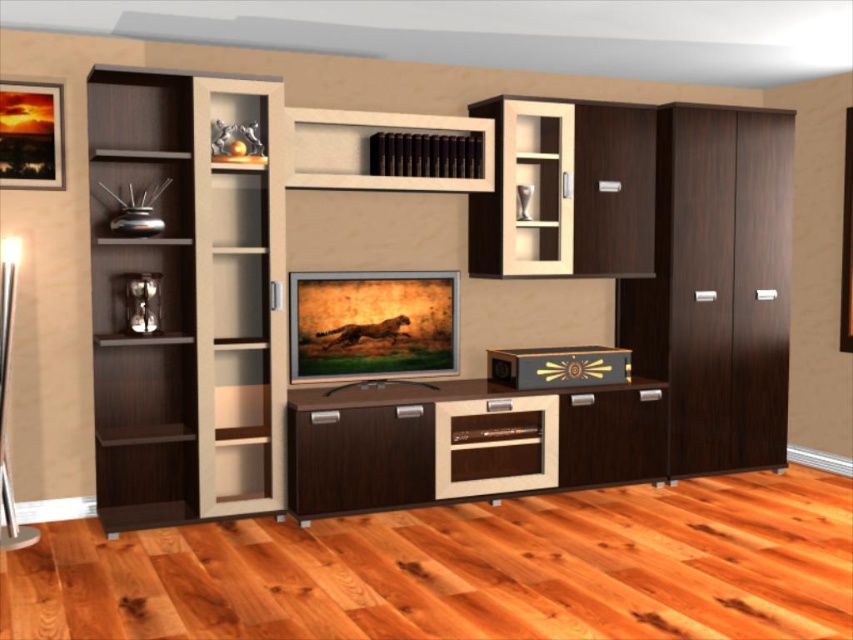
Question: Is dark wood entertainment center at center further to camera compared to dark wood/woodenbookshelf at left?

Choices:
 (A) no
 (B) yes

Answer: (B)

Question: Which is farther from the matte wood shelf at upper center?

Choices:
 (A) dark wood/woodenbookshelf at left
 (B) dark wood entertainment center at center

Answer: (A)

Question: Is dark wood/woodenbookshelf at left positioned in front of matte wood shelf at upper center?

Choices:
 (A) no
 (B) yes

Answer: (B)

Question: Does dark wood entertainment center at center appear on the right side of brown matte books at upper center?

Choices:
 (A) yes
 (B) no

Answer: (A)

Question: Which object appears farthest from the camera in this image?

Choices:
 (A) dark wood entertainment center at center
 (B) brown matte books at upper center
 (C) dark wood/woodenbookshelf at left
 (D) matte wood shelf at upper center

Answer: (D)

Question: Which point appears closest to the camera in this image?

Choices:
 (A) (491, 198)
 (B) (277, 433)
 (C) (399, 168)

Answer: (B)